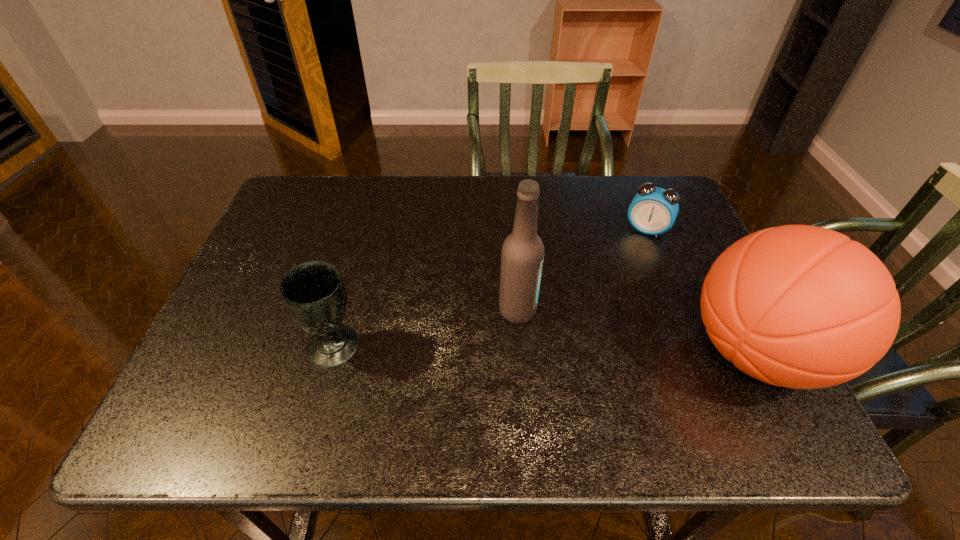
Locate an element on the screen. Image resolution: width=960 pixels, height=540 pixels. free point between the alarm clock and the beer bottle is located at coordinates (582, 269).

Find the location of a particular element. free point between the basketball and the alarm clock is located at coordinates (701, 291).

You are a GUI agent. You are given a task and a screenshot of the screen. Output one action in this format:
    pyautogui.click(x=<x>, y=<y>)
    Task: Click on the unoccupied position between the basketball and the alarm clock
    The width and height of the screenshot is (960, 540).
    Given the screenshot: What is the action you would take?
    pyautogui.click(x=701, y=291)

Where is `vacant space that's between the beer bottle and the third tallest object`? The width and height of the screenshot is (960, 540). vacant space that's between the beer bottle and the third tallest object is located at coordinates (425, 328).

Where is `blank region between the beer bottle and the basketball`? blank region between the beer bottle and the basketball is located at coordinates (636, 331).

You are a GUI agent. You are given a task and a screenshot of the screen. Output one action in this format:
    pyautogui.click(x=<x>, y=<y>)
    Task: Click on the free spot between the basketball and the shortest object
    
    Given the screenshot: What is the action you would take?
    pyautogui.click(x=701, y=291)

Select which object appears as the closest to the alarm clock. Please provide its 2D coordinates. Your answer should be formatted as a tuple, i.e. [(x, y)], where the tuple contains the x and y coordinates of a point satisfying the conditions above.

[(798, 306)]

I want to click on object that stands as the third closest to the second shortest object, so point(653,211).

Identify the location of blank space that satisfies the following two spatial constraints: 1. on the front side of the basketball; 2. on the left side of the alarm clock. (697, 352).

Where is `free space in the image that satisfies the following two spatial constraints: 1. on the front side of the shortest object; 2. on the right side of the basketball`? Image resolution: width=960 pixels, height=540 pixels. free space in the image that satisfies the following two spatial constraints: 1. on the front side of the shortest object; 2. on the right side of the basketball is located at coordinates (697, 352).